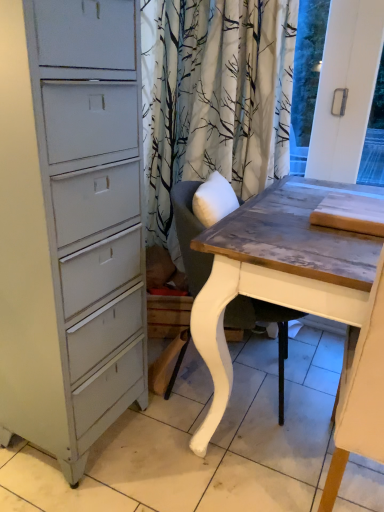
At what (x,y) coordinates should I click in order to perform the action: click on free region under white painted wood chair at center (from a real-world perspective). Please return your answer as a coordinate pair (x, y). The image size is (384, 512). Looking at the image, I should click on coord(238,400).